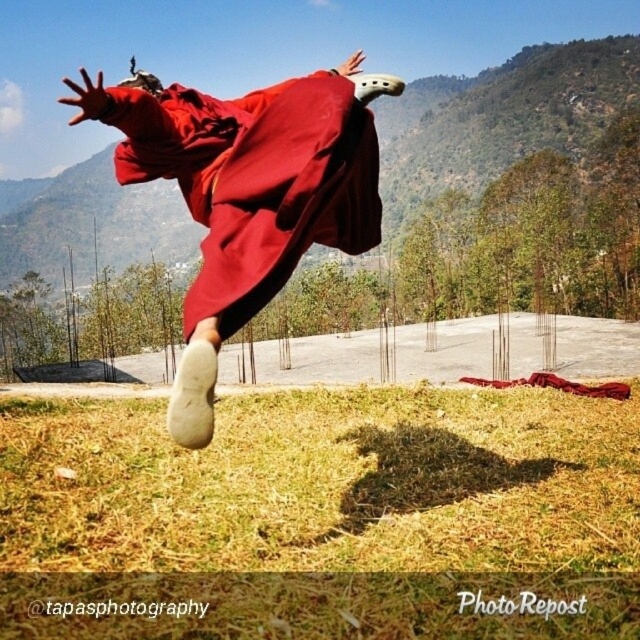
Question: Which object appears closest to the camera in this image?

Choices:
 (A) matte red robe at center
 (B) dry grass at lower center

Answer: (A)

Question: Which point is farther to the camera?

Choices:
 (A) dry grass at lower center
 (B) matte red robe at center

Answer: (A)

Question: Does dry grass at lower center appear on the left side of matte red robe at center?

Choices:
 (A) no
 (B) yes

Answer: (A)

Question: Can you confirm if dry grass at lower center is positioned above matte red robe at center?

Choices:
 (A) no
 (B) yes

Answer: (A)

Question: Is dry grass at lower center closer to camera compared to matte red robe at center?

Choices:
 (A) no
 (B) yes

Answer: (A)